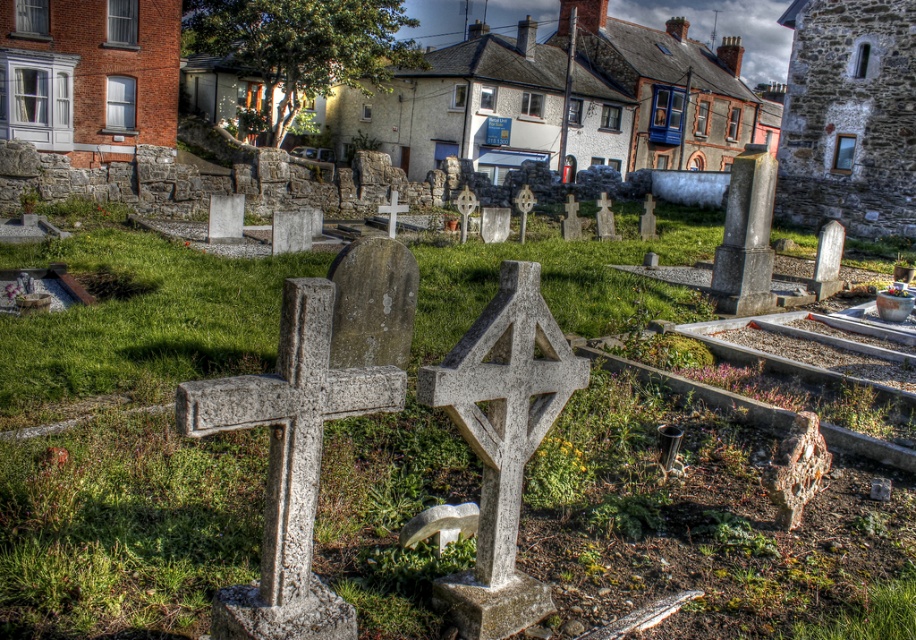
Which is more to the left, white stone cross at center or smooth stone cross at center?

smooth stone cross at center

From the picture: Is white stone cross at center behind smooth stone cross at center?

No, white stone cross at center is in front of smooth stone cross at center.

What do you see at coordinates (500, 442) in the screenshot? I see `white stone cross at center` at bounding box center [500, 442].

Where is `white stone cross at center`? The height and width of the screenshot is (640, 916). white stone cross at center is located at coordinates (500, 442).